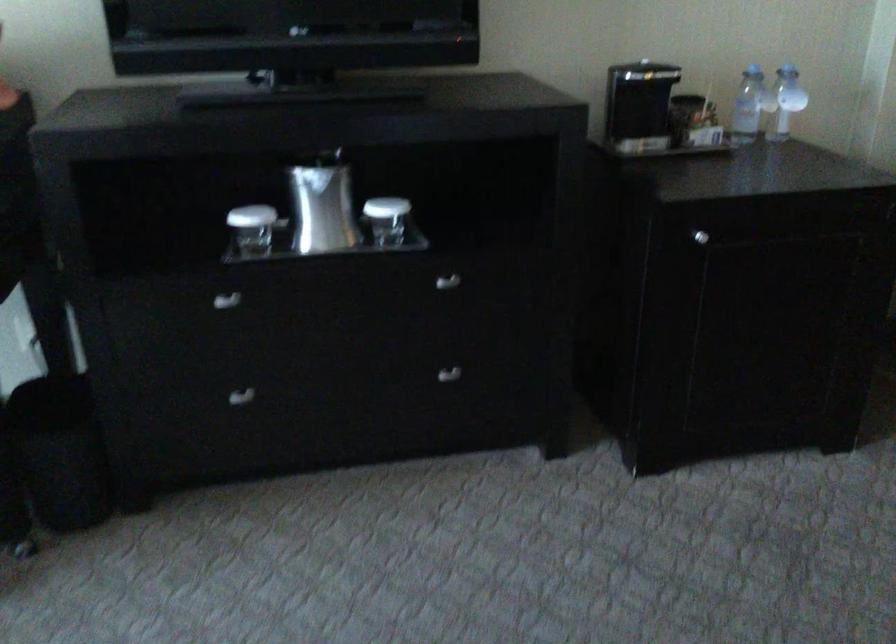
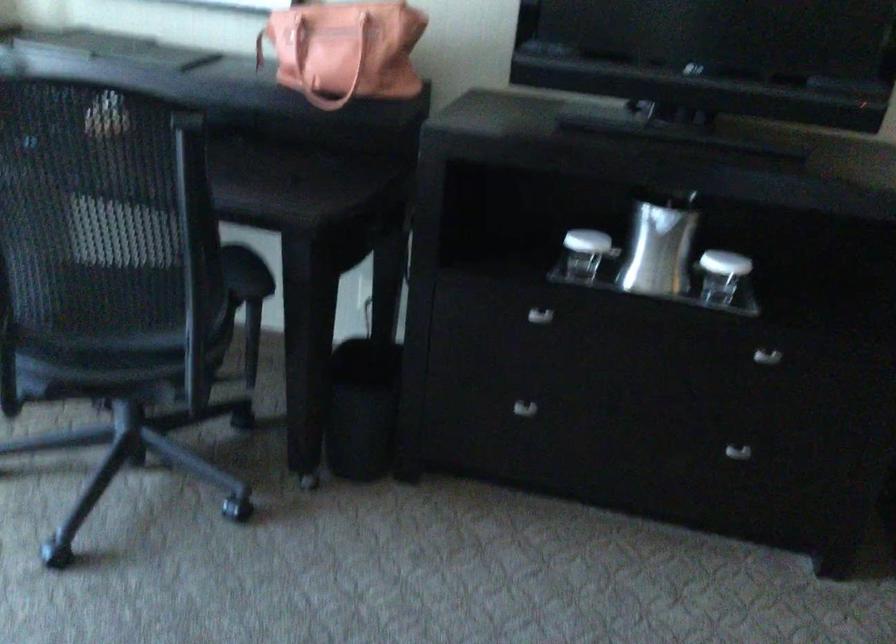
In the second image, find the point that corresponds to (444,375) in the first image.

(737, 451)